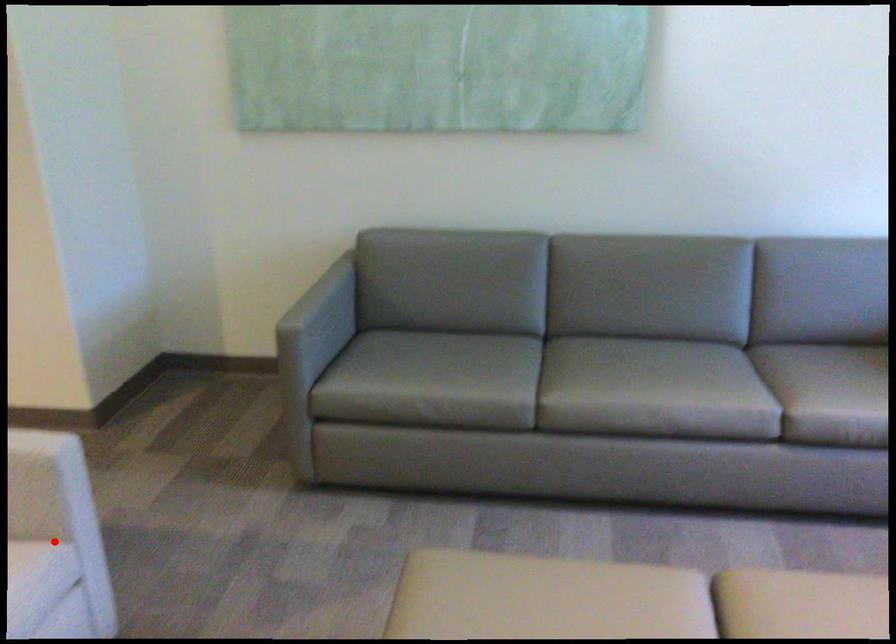
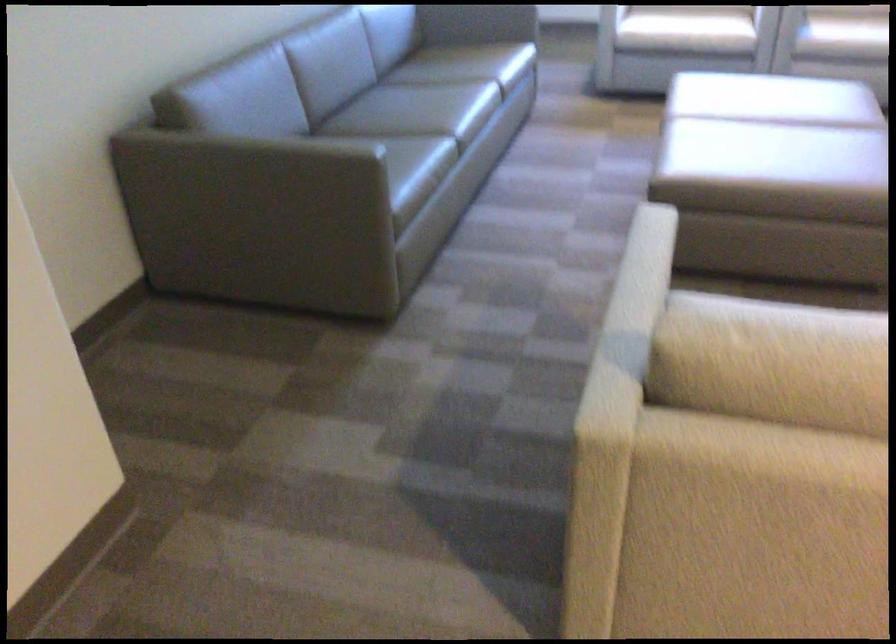
Question: I am providing you with two images of the same scene from different viewpoints. A red point is marked on the first image. Can you still see the location of the red point in image 2?

Choices:
 (A) Yes
 (B) No

Answer: (B)